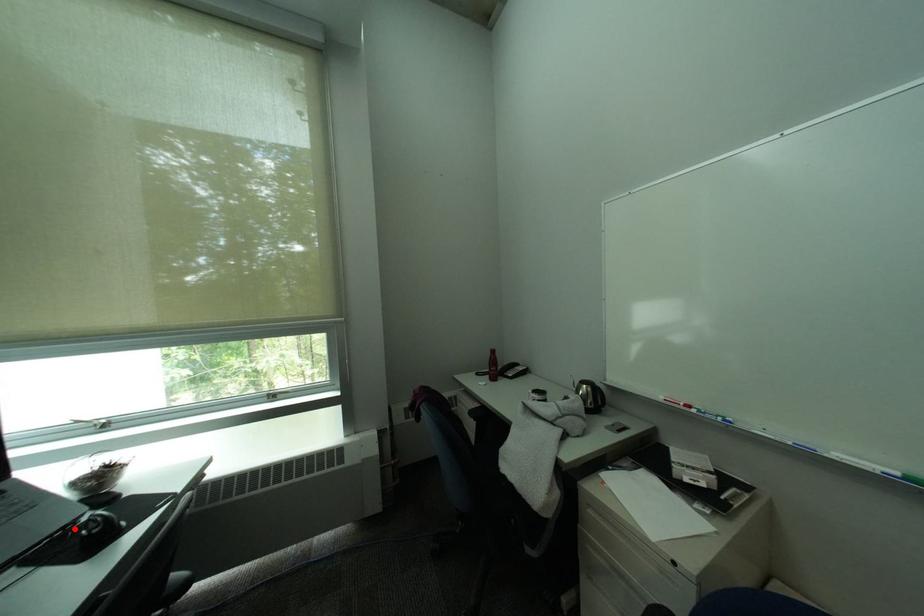
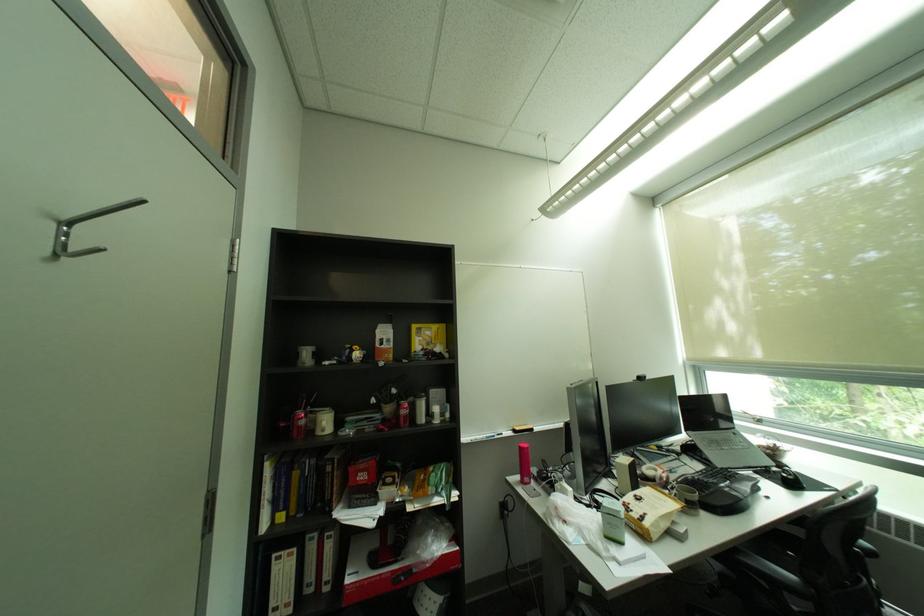
Locate, in the second image, the point that corresponds to the highlighted location in the first image.

(777, 468)